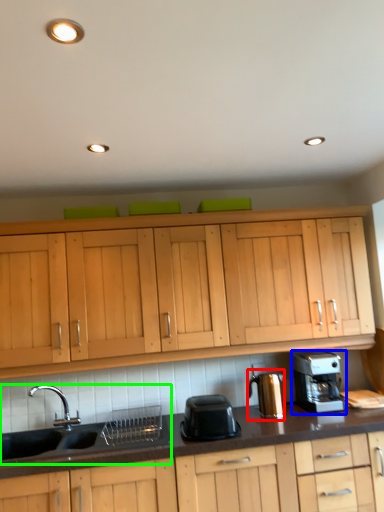
Question: Which is nearer to the coffee machine (highlighted by a red box)? home appliance (highlighted by a blue box) or sink (highlighted by a green box).

Choices:
 (A) home appliance
 (B) sink

Answer: (A)